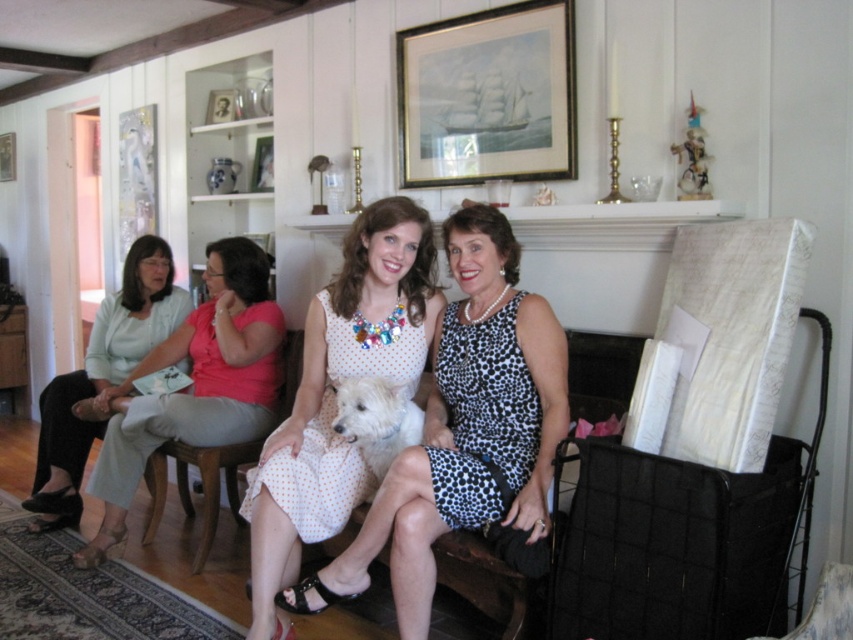
What do you see at coordinates (463, 429) in the screenshot?
I see `white dotted dress at center` at bounding box center [463, 429].

Can you confirm if white dotted dress at center is thinner than white fur dog at center?

Incorrect, white dotted dress at center's width is not less than white fur dog at center's.

Is point (491, 368) positioned behind point (381, 454)?

No, (491, 368) is in front of (381, 454).

Locate an element on the screen. Image resolution: width=853 pixels, height=640 pixels. white dotted dress at center is located at coordinates (463, 429).

Which is below, gold-framed print at upper center or light pink fabric dress at left?

light pink fabric dress at left is below.

Is gold-framed print at upper center shorter than light pink fabric dress at left?

Yes, gold-framed print at upper center is shorter than light pink fabric dress at left.

What are the coordinates of `gold-framed print at upper center` in the screenshot? It's located at (488, 97).

Is white dotted dress at center positioned behind wooden picture frame at upper left?

No, white dotted dress at center is in front of wooden picture frame at upper left.

Which is in front, point (410, 605) or point (12, 157)?

Point (410, 605) is in front.

What are the coordinates of `white dotted dress at center` in the screenshot? It's located at (463, 429).